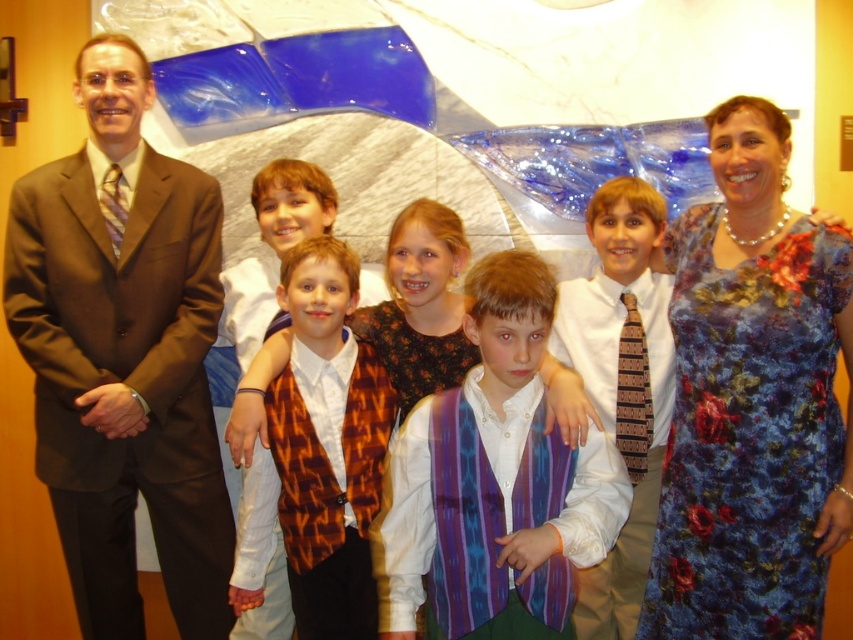
Can you confirm if orange patterned vest at center is smaller than brown striped tie at center?

Result: Actually, orange patterned vest at center might be larger than brown striped tie at center.

Between point (360, 474) and point (622, 298), which one is positioned behind?

Point (622, 298)

Is point (293, 326) more distant than point (641, 392)?

That is False.

Where is `orange patterned vest at center`? The width and height of the screenshot is (853, 640). orange patterned vest at center is located at coordinates (318, 454).

Which is above, brown suit at left or brown striped tie at center?

Positioned higher is brown suit at left.

Is point (103, 344) behind point (625, 448)?

No.

Where is `brown suit at left`? The height and width of the screenshot is (640, 853). brown suit at left is located at coordinates (123, 356).

Locate an element on the screen. The image size is (853, 640). brown suit at left is located at coordinates pos(123,356).

Consider the image. Can you confirm if floral silk dress at right is bigger than orange patterned vest at center?

Indeed, floral silk dress at right has a larger size compared to orange patterned vest at center.

Between floral silk dress at right and orange patterned vest at center, which one is positioned lower?

Positioned lower is orange patterned vest at center.

Measure the distance between floral silk dress at right and camera.

1.87 meters

Where is `floral silk dress at right`? floral silk dress at right is located at coordinates (752, 401).